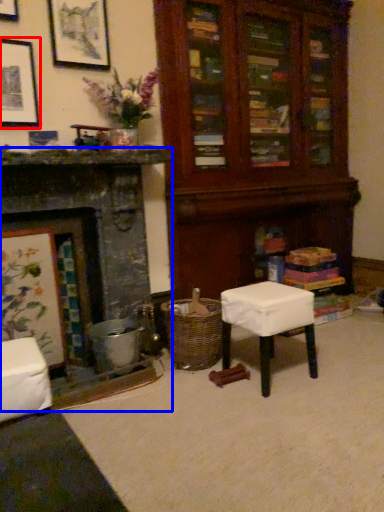
Question: Among these objects, which one is farthest to the camera, picture frame (highlighted by a red box) or fireplace (highlighted by a blue box)?

Choices:
 (A) picture frame
 (B) fireplace

Answer: (A)